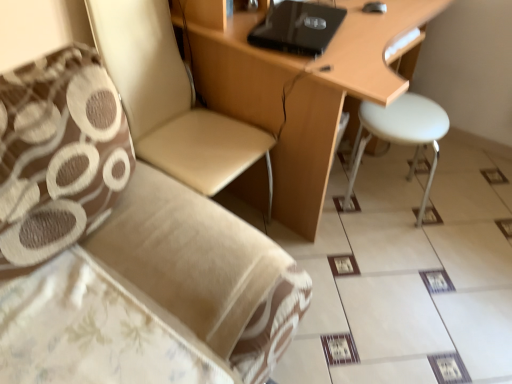
This screenshot has width=512, height=384. I want to click on free space to the right of white plastic stool at right, so click(462, 204).